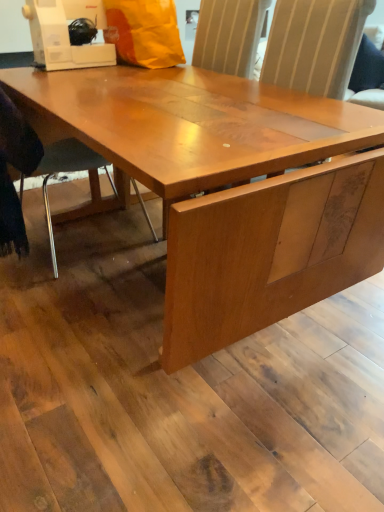
Question: Is metallic gray chair at lower left at the left side of white plastic sewing machine at upper left?

Choices:
 (A) no
 (B) yes

Answer: (B)

Question: Can you confirm if metallic gray chair at lower left is shorter than white plastic sewing machine at upper left?

Choices:
 (A) yes
 (B) no

Answer: (B)

Question: Does metallic gray chair at lower left have a lesser width compared to white plastic sewing machine at upper left?

Choices:
 (A) no
 (B) yes

Answer: (A)

Question: Does metallic gray chair at lower left have a smaller size compared to white plastic sewing machine at upper left?

Choices:
 (A) no
 (B) yes

Answer: (A)

Question: Would you say white plastic sewing machine at upper left is part of metallic gray chair at lower left's contents?

Choices:
 (A) yes
 (B) no

Answer: (B)

Question: Is metallic gray chair at lower left turned away from white plastic sewing machine at upper left?

Choices:
 (A) yes
 (B) no

Answer: (B)

Question: From a real-world perspective, does white plastic sewing machine at upper left stand above orange matte paper bag at upper center?

Choices:
 (A) yes
 (B) no

Answer: (A)

Question: Can you confirm if white plastic sewing machine at upper left is positioned to the left of orange matte paper bag at upper center?

Choices:
 (A) yes
 (B) no

Answer: (A)

Question: Would you say white plastic sewing machine at upper left is outside orange matte paper bag at upper center?

Choices:
 (A) yes
 (B) no

Answer: (A)

Question: Does white plastic sewing machine at upper left contain orange matte paper bag at upper center?

Choices:
 (A) yes
 (B) no

Answer: (B)

Question: Can you confirm if white plastic sewing machine at upper left is smaller than orange matte paper bag at upper center?

Choices:
 (A) yes
 (B) no

Answer: (A)

Question: From a real-world perspective, is white plastic sewing machine at upper left beneath orange matte paper bag at upper center?

Choices:
 (A) yes
 (B) no

Answer: (B)

Question: Is orange matte paper bag at upper center far away from metallic gray chair at lower left?

Choices:
 (A) yes
 (B) no

Answer: (B)